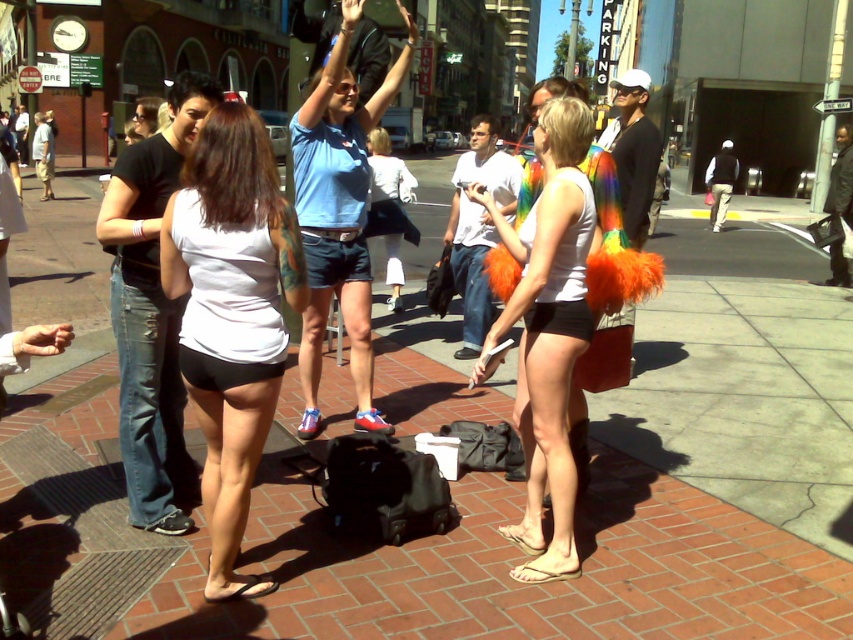
Looking at this image, you are a delivery robot that is 1.2 meters wide. You need to move through the space between the white matte shorts at lower left and the tan leather sandal at lower center. Can you fit through the space without touching either?

The distance between the white matte shorts at lower left and the tan leather sandal at lower center is 1.42 meters. Since the robot is 1.2 meters wide, it can fit through the space as there is enough clearance.

Consider the image. You are standing at the center of the image. Which direction should you look to see the white matte shorts at lower left?

You should look to the lower left direction to see the white matte shorts at lower left.

Based on the scene described, which object, the white matte shorts at center or the tan leather sandal at lower center, is taller?

The white matte shorts at center is taller than the tan leather sandal at lower center according to the description.